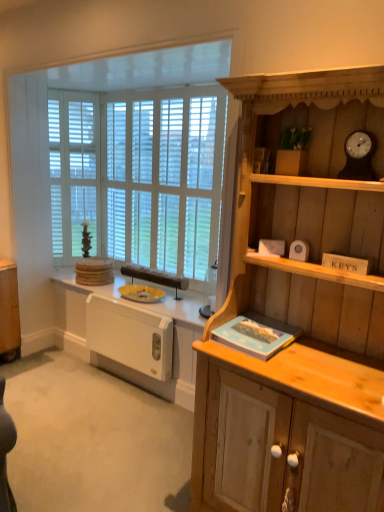
Where is `free point above white wood blinds at left (from a real-world perspective)`? free point above white wood blinds at left (from a real-world perspective) is located at coordinates (69, 90).